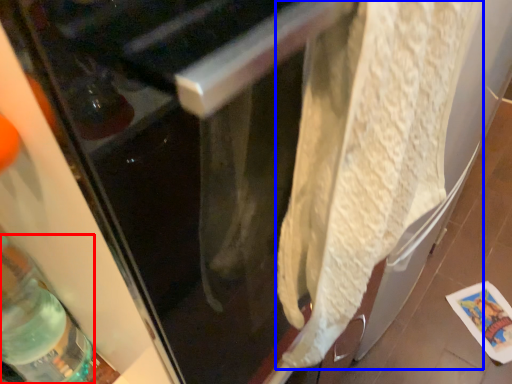
Question: Which object is further to the camera taking this photo, bottle (highlighted by a red box) or wrap (highlighted by a blue box)?

Choices:
 (A) bottle
 (B) wrap

Answer: (A)